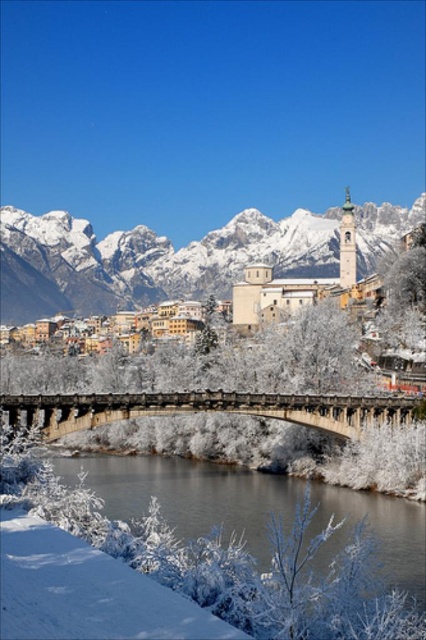
Question: From the image, what is the correct spatial relationship of snowy granite mountains at upper center in relation to concrete bridge at center?

Choices:
 (A) above
 (B) below

Answer: (A)

Question: Which point is closer to the camera?

Choices:
 (A) (325, 417)
 (B) (163, 547)
 (C) (192, 288)

Answer: (B)

Question: Among these objects, which one is farthest from the camera?

Choices:
 (A) snowy granite mountains at upper center
 (B) white frosted water at lower center

Answer: (A)

Question: Does white frosted water at lower center have a lesser width compared to snowy granite mountains at upper center?

Choices:
 (A) no
 (B) yes

Answer: (B)

Question: Which object appears farthest from the camera in this image?

Choices:
 (A) concrete bridge at center
 (B) white frosted water at lower center
 (C) snowy granite mountains at upper center

Answer: (C)

Question: Does white frosted water at lower center have a larger size compared to snowy granite mountains at upper center?

Choices:
 (A) yes
 (B) no

Answer: (B)